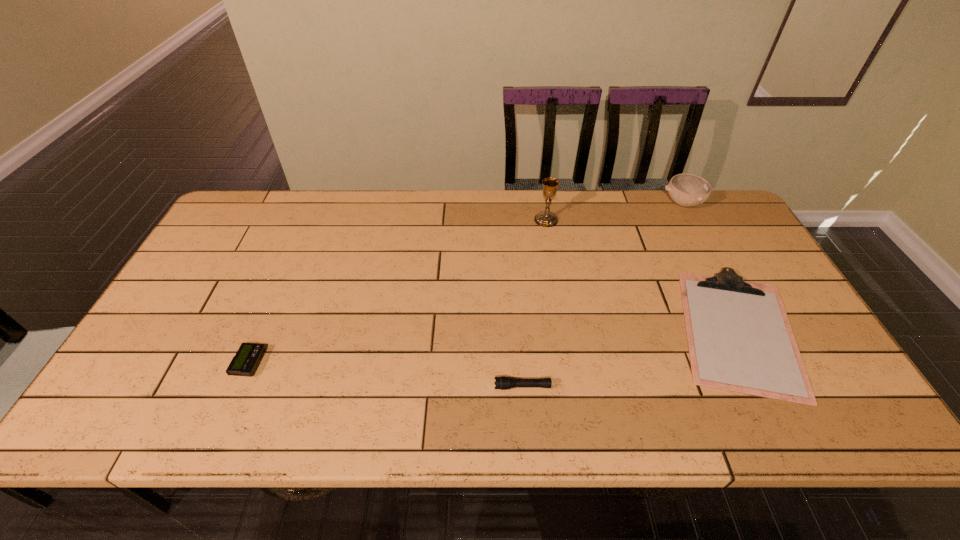
The width and height of the screenshot is (960, 540). I want to click on free space between the clipboard and the beeper, so click(493, 347).

Where is `free space between the second object from left to right and the tallest object`? free space between the second object from left to right and the tallest object is located at coordinates (535, 303).

Locate an element on the screen. vacant space that's between the third object from left to right and the bowl is located at coordinates (614, 212).

Where is `empty space that is in between the clipboard and the bowl`? empty space that is in between the clipboard and the bowl is located at coordinates (711, 267).

The image size is (960, 540). In order to click on vacant area between the tallest object and the clipboard in this screenshot , I will do tap(642, 275).

Find the location of a particular element. free space between the beeper and the fourth shortest object is located at coordinates (467, 283).

Choose which object is the fourth nearest neighbor to the bowl. Please provide its 2D coordinates. Your answer should be formatted as a tuple, i.e. [(x, y)], where the tuple contains the x and y coordinates of a point satisfying the conditions above.

[(244, 363)]

Identify which object is the third nearest to the leftmost object. Please provide its 2D coordinates. Your answer should be formatted as a tuple, i.e. [(x, y)], where the tuple contains the x and y coordinates of a point satisfying the conditions above.

[(739, 337)]

Where is `vacant space that satisfies the following two spatial constraints: 1. on the back side of the third object from right to left; 2. on the right side of the fourth shortest object`? The height and width of the screenshot is (540, 960). vacant space that satisfies the following two spatial constraints: 1. on the back side of the third object from right to left; 2. on the right side of the fourth shortest object is located at coordinates (543, 204).

In order to click on vacant region that satisfies the following two spatial constraints: 1. on the back side of the beeper; 2. on the left side of the clipboard in this screenshot , I will do `click(263, 331)`.